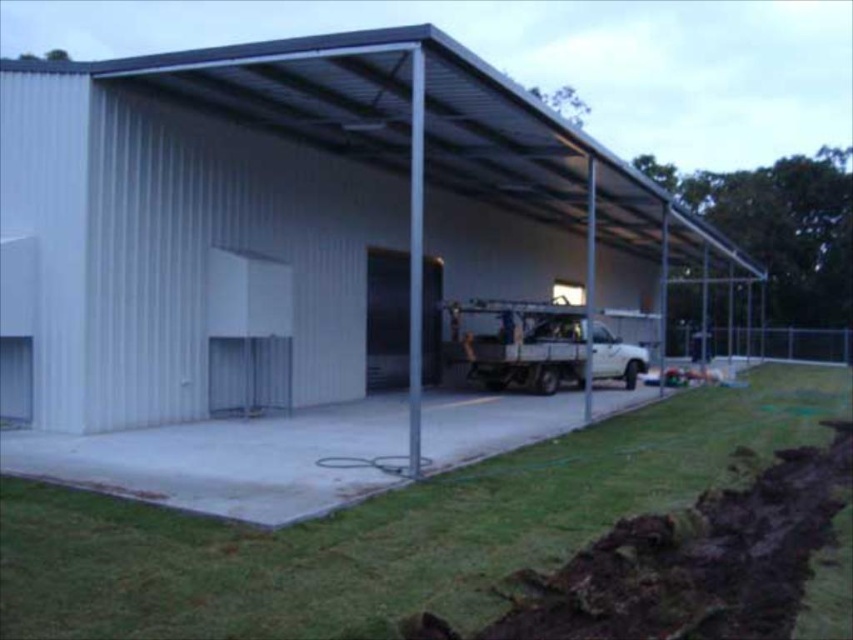
The width and height of the screenshot is (853, 640). In order to click on white corrugated metal building at center in this screenshot , I will do `click(296, 204)`.

Does white corrugated metal building at center have a greater width compared to gray concrete pavement at center?

Yes.

Between point (207, 113) and point (763, 396), which one is positioned behind?

Point (763, 396)

Find the location of `white corrugated metal building at center`. white corrugated metal building at center is located at coordinates (296, 204).

Describe the element at coordinates (296, 204) in the screenshot. This screenshot has width=853, height=640. I see `white corrugated metal building at center` at that location.

Which of these two, white corrugated metal building at center or white matte truck at center, stands shorter?

white matte truck at center is shorter.

This screenshot has height=640, width=853. Describe the element at coordinates (296, 204) in the screenshot. I see `white corrugated metal building at center` at that location.

Image resolution: width=853 pixels, height=640 pixels. Find the location of `white corrugated metal building at center`. white corrugated metal building at center is located at coordinates (296, 204).

Between point (480, 618) and point (396, 337), which one is positioned in front?

Point (480, 618)

The height and width of the screenshot is (640, 853). I want to click on gray concrete pavement at center, so click(x=384, y=529).

You are a GUI agent. You are given a task and a screenshot of the screen. Output one action in this format:
    pyautogui.click(x=<x>, y=<y>)
    Task: Click on the gray concrete pavement at center
    
    Given the screenshot: What is the action you would take?
    pyautogui.click(x=384, y=529)